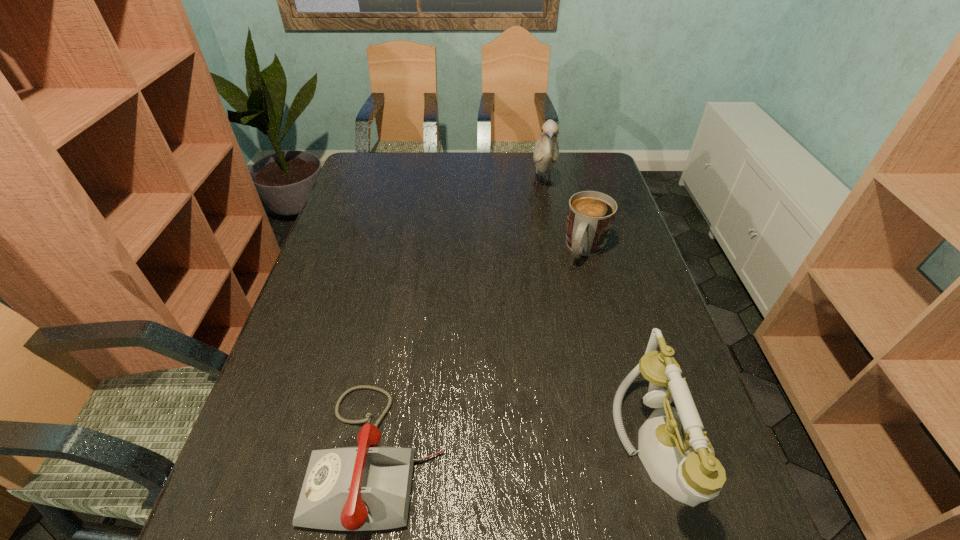
Where is `vacant region that satisfies the following two spatial constraints: 1. on the front side of the right telephone; 2. on the dial of the farthest object`? Image resolution: width=960 pixels, height=540 pixels. vacant region that satisfies the following two spatial constraints: 1. on the front side of the right telephone; 2. on the dial of the farthest object is located at coordinates (591, 446).

You are a GUI agent. You are given a task and a screenshot of the screen. Output one action in this format:
    pyautogui.click(x=<x>, y=<y>)
    Task: Click on the vacant region that satisfies the following two spatial constraints: 1. on the front side of the farthest object; 2. on the dial of the third shortest object
    
    Given the screenshot: What is the action you would take?
    pyautogui.click(x=591, y=446)